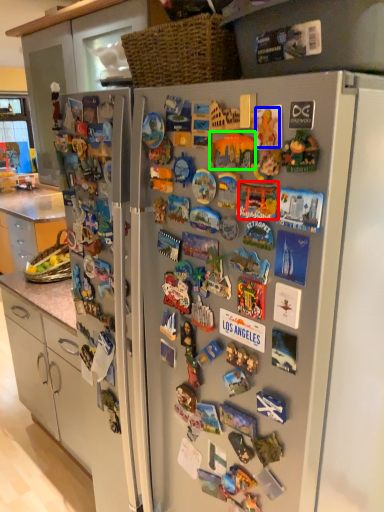
Question: Which is nearer to the toy (highlighted by a red box)? toy (highlighted by a blue box) or toy (highlighted by a green box).

Choices:
 (A) toy
 (B) toy

Answer: (B)